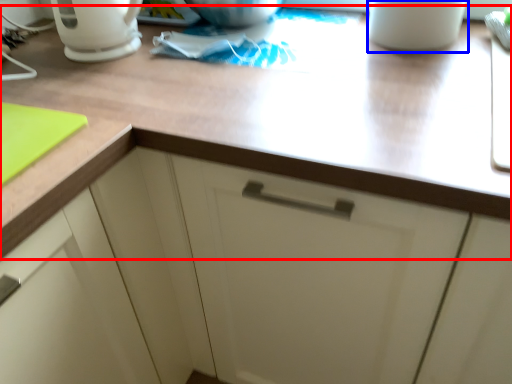
Question: Which of the following is the closest to the observer, countertop (highlighted by a red box) or mug (highlighted by a blue box)?

Choices:
 (A) countertop
 (B) mug

Answer: (A)